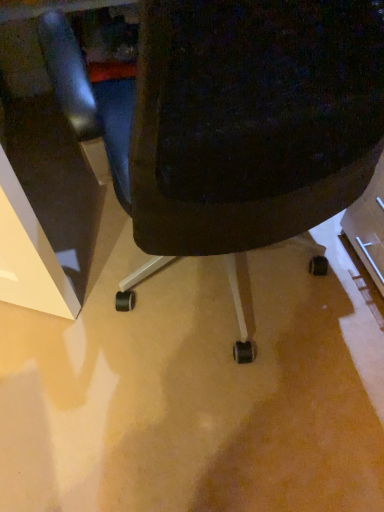
This screenshot has width=384, height=512. Identify the location of vacant region below black fabric chair at center (from a real-world perspective). (223, 307).